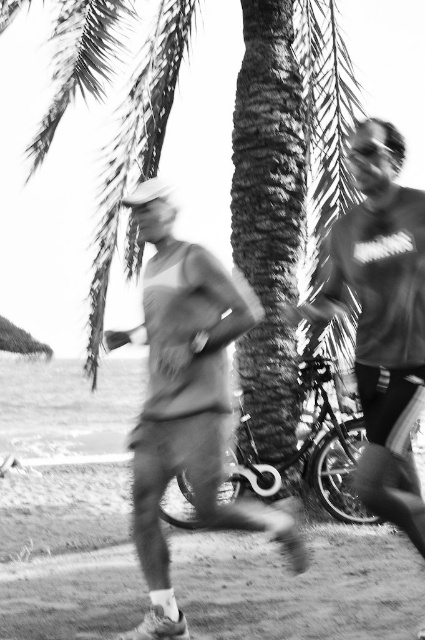
Question: Which point appears farthest from the camera in this image?

Choices:
 (A) (387, 449)
 (B) (146, 481)

Answer: (B)

Question: Can you confirm if smooth fabric shirt at center is positioned below matte gray t-shirt at right?

Choices:
 (A) no
 (B) yes

Answer: (B)

Question: Is smooth fabric shirt at center bigger than matte gray t-shirt at right?

Choices:
 (A) yes
 (B) no

Answer: (A)

Question: Observing the image, what is the correct spatial positioning of smooth fabric shirt at center in reference to matte gray t-shirt at right?

Choices:
 (A) left
 (B) right

Answer: (A)

Question: Which point is farther from the camera taking this photo?

Choices:
 (A) (144, 628)
 (B) (340, 228)

Answer: (A)

Question: Which point appears closest to the camera in this image?

Choices:
 (A) click(396, 509)
 (B) click(136, 477)

Answer: (A)